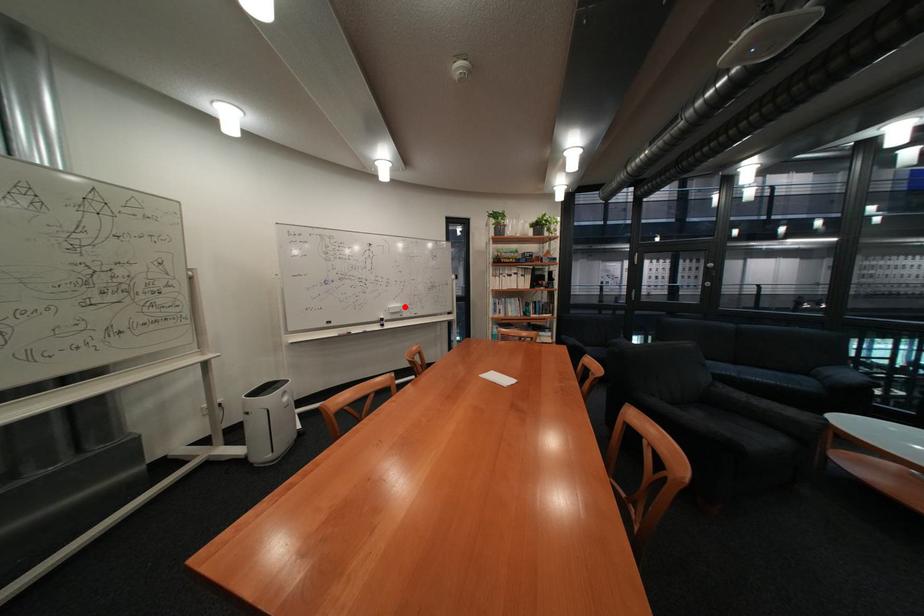
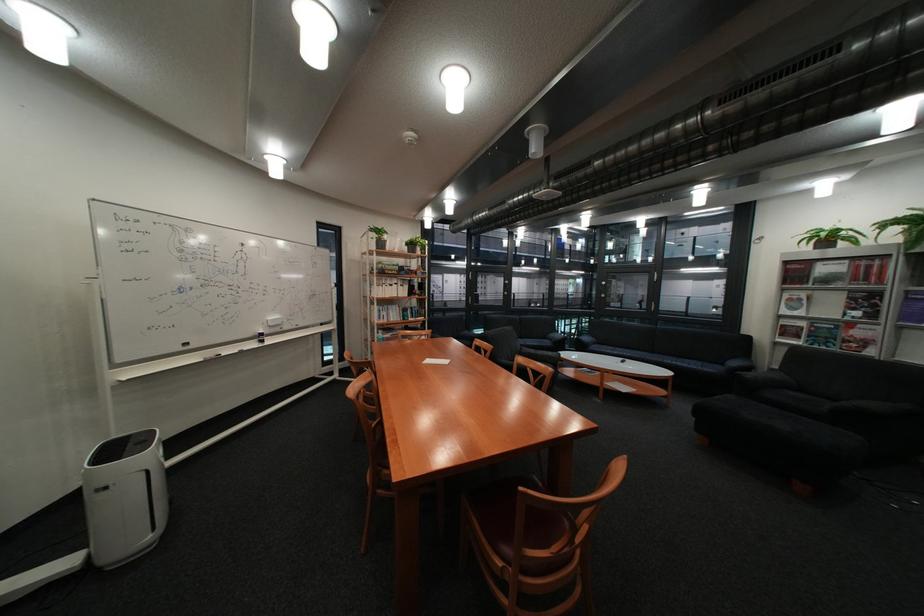
In the second image, find the point that corresponds to the highlighted location in the first image.

(284, 318)